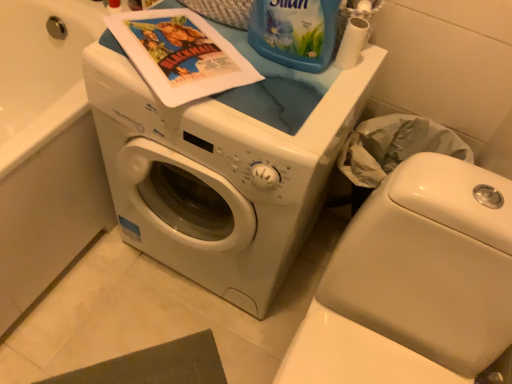
Where is `white glossy washer at lower left`? white glossy washer at lower left is located at coordinates tap(413, 283).

Where is `matte paper comic book at upper center`? matte paper comic book at upper center is located at coordinates (180, 54).

This screenshot has width=512, height=384. In order to click on blue plastic bottle at upper center in this screenshot , I will do (294, 32).

Locate an element on the screen. white glossy washer at lower left is located at coordinates (413, 283).

Considering the positions of objects white glossy washer at lower left and white matte toilet paper at upper right in the image provided, who is in front, white glossy washer at lower left or white matte toilet paper at upper right?

white glossy washer at lower left is closer to the camera.

How different are the orientations of white glossy washer at lower left and white matte toilet paper at upper right in degrees?

The angle between the facing direction of white glossy washer at lower left and the facing direction of white matte toilet paper at upper right is 0.997 degrees.

Would you say white glossy washer at lower left is a long distance from white matte toilet paper at upper right?

No, white glossy washer at lower left is in close proximity to white matte toilet paper at upper right.

Is white glossy washer at lower left facing towards white matte toilet paper at upper right?

No, white glossy washer at lower left does not turn towards white matte toilet paper at upper right.

From a real-world perspective, is white matte toilet paper at upper right below matte paper comic book at upper center?

No, from a real-world perspective, white matte toilet paper at upper right is not below matte paper comic book at upper center.

Is white matte toilet paper at upper right to the left or to the right of matte paper comic book at upper center in the image?

In the image, white matte toilet paper at upper right appears on the right side of matte paper comic book at upper center.

Looking at the image, does white matte toilet paper at upper right seem bigger or smaller compared to matte paper comic book at upper center?

In the image, white matte toilet paper at upper right appears to be smaller than matte paper comic book at upper center.

Measure the distance between white glossy washing machine at center and blue plastic bottle at upper center.

The distance of white glossy washing machine at center from blue plastic bottle at upper center is 12.81 inches.

From a real-world perspective, is white glossy washing machine at center located beneath blue plastic bottle at upper center?

Yes, from a real-world perspective, white glossy washing machine at center is beneath blue plastic bottle at upper center.

Is blue plastic bottle at upper center inside white glossy washing machine at center?

Definitely not — blue plastic bottle at upper center is not inside white glossy washing machine at center.

Is white glossy washing machine at center to the left of blue plastic bottle at upper center from the viewer's perspective?

Yes.

Does white matte toilet paper at upper right turn towards white glossy washer at lower left?

No, white matte toilet paper at upper right is not turned towards white glossy washer at lower left.

Is the position of white matte toilet paper at upper right more distant than that of white glossy washer at lower left?

Yes, white matte toilet paper at upper right is further from the viewer.

Is white matte toilet paper at upper right wider than white glossy washer at lower left?

No.

At what (x,y) coordinates should I click in order to perform the action: click on toilet paper directly beneath the blue plastic bottle at upper center (from a real-world perspective). Please return your answer as a coordinate pair (x, y). This screenshot has width=512, height=384. Looking at the image, I should click on (352, 43).

Is white matte toilet paper at upper right far away from blue plastic bottle at upper center?

That's not correct — white matte toilet paper at upper right is a little close to blue plastic bottle at upper center.

Between white matte toilet paper at upper right and blue plastic bottle at upper center, which one has more height?

blue plastic bottle at upper center is taller.

The image size is (512, 384). What are the coordinates of `comic book that appears on the left of blue plastic bottle at upper center` in the screenshot? It's located at (180, 54).

Considering the relative sizes of blue plastic bottle at upper center and matte paper comic book at upper center in the image provided, is blue plastic bottle at upper center smaller than matte paper comic book at upper center?

No.

Can you see blue plastic bottle at upper center touching matte paper comic book at upper center?

They are not placed beside each other.

In the image, is blue plastic bottle at upper center on the left side or the right side of matte paper comic book at upper center?

Based on their positions, blue plastic bottle at upper center is located to the right of matte paper comic book at upper center.

In the scene shown: How many degrees apart are the facing directions of white glossy washer at lower left and white glossy washing machine at center?

The angular difference between white glossy washer at lower left and white glossy washing machine at center is 0.000287 degrees.

Is white glossy washer at lower left taller or shorter than white glossy washing machine at center?

white glossy washer at lower left is shorter than white glossy washing machine at center.

Which is closer, [453,269] or [302,110]?

Clearly, point [453,269] is closer to the camera than point [302,110].

From the image's perspective, is white glossy washer at lower left beneath white glossy washing machine at center?

Indeed, from the image's perspective, white glossy washer at lower left is shown beneath white glossy washing machine at center.

This screenshot has width=512, height=384. In order to click on washer on the right side of white matte toilet paper at upper right in this screenshot , I will do `click(413, 283)`.

In the image, there is a white matte toilet paper at upper right. Where is `comic book below it (from the image's perspective)`? comic book below it (from the image's perspective) is located at coordinates coord(180,54).

When comparing their distances from matte paper comic book at upper center, does blue plastic bottle at upper center or white matte toilet paper at upper right seem further?

white matte toilet paper at upper right is further to matte paper comic book at upper center.

Looking at this image, considering their positions, is matte paper comic book at upper center positioned further to blue plastic bottle at upper center than white matte toilet paper at upper right?

matte paper comic book at upper center lies further to blue plastic bottle at upper center than the other object.

Estimate the real-world distances between objects in this image. Which object is further from white glossy washing machine at center, blue plastic bottle at upper center or white glossy washer at lower left?

blue plastic bottle at upper center lies further to white glossy washing machine at center than the other object.

Looking at the image, which one is located further to matte paper comic book at upper center, white glossy washing machine at center or white glossy washer at lower left?

The object further to matte paper comic book at upper center is white glossy washer at lower left.

Estimate the real-world distances between objects in this image. Which object is closer to white matte toilet paper at upper right, white glossy washer at lower left or white glossy washing machine at center?

Among the two, white glossy washing machine at center is located nearer to white matte toilet paper at upper right.

Estimate the real-world distances between objects in this image. Which object is closer to white glossy washer at lower left, white glossy washing machine at center or blue plastic bottle at upper center?

white glossy washing machine at center is closer to white glossy washer at lower left.

Looking at the image, which one is located closer to blue plastic bottle at upper center, matte paper comic book at upper center or white glossy washing machine at center?

matte paper comic book at upper center is closer to blue plastic bottle at upper center.

Estimate the real-world distances between objects in this image. Which object is closer to white glossy washing machine at center, white glossy washer at lower left or blue plastic bottle at upper center?

white glossy washer at lower left is positioned closer to the anchor white glossy washing machine at center.

Where is `washing machine between matte paper comic book at upper center and white glossy washer at lower left in the up-down direction`? washing machine between matte paper comic book at upper center and white glossy washer at lower left in the up-down direction is located at coordinates (223, 164).

You are a GUI agent. You are given a task and a screenshot of the screen. Output one action in this format:
    pyautogui.click(x=<x>, y=<y>)
    Task: Click on the washing machine between white matte toilet paper at upper right and white glossy washer at lower left vertically
    This screenshot has width=512, height=384.
    Given the screenshot: What is the action you would take?
    pyautogui.click(x=223, y=164)

In order to click on toilet paper between blue plastic bottle at upper center and white glossy washer at lower left in the up-down direction in this screenshot , I will do pos(352,43).

I want to click on comic book between blue plastic bottle at upper center and white glossy washer at lower left vertically, so pos(180,54).